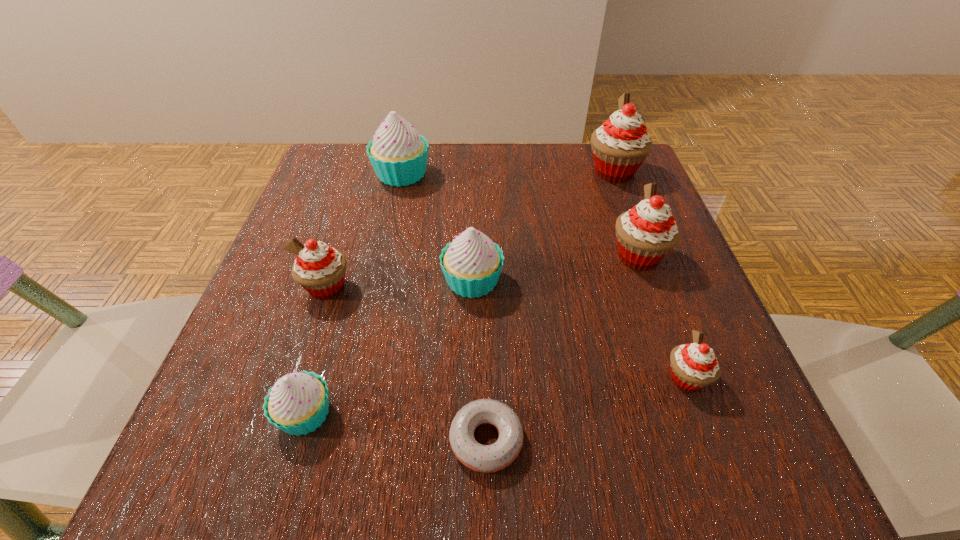
Where is `free location located on the front of the farthest pink cupcake`? This screenshot has height=540, width=960. free location located on the front of the farthest pink cupcake is located at coordinates (637, 232).

You are a GUI agent. You are given a task and a screenshot of the screen. Output one action in this format:
    pyautogui.click(x=<x>, y=<y>)
    Task: Click on the free space located 0.230m on the right of the biggest white cupcake
    The height and width of the screenshot is (540, 960).
    Given the screenshot: What is the action you would take?
    pyautogui.click(x=531, y=174)

You are a GUI agent. You are given a task and a screenshot of the screen. Output one action in this format:
    pyautogui.click(x=<x>, y=<y>)
    Task: Click on the free region located on the back of the second biggest pink cupcake
    Image resolution: width=960 pixels, height=540 pixels.
    Given the screenshot: What is the action you would take?
    pyautogui.click(x=615, y=192)

The width and height of the screenshot is (960, 540). I want to click on vacant space located on the back of the fourth cupcake from left to right, so click(473, 216).

Image resolution: width=960 pixels, height=540 pixels. In order to click on free space located on the front of the third biggest pink cupcake in this screenshot , I will do `click(307, 346)`.

Identify the location of free space located 0.320m on the back of the nearest pink cupcake. The height and width of the screenshot is (540, 960). pos(629,225).

You are a GUI agent. You are given a task and a screenshot of the screen. Output one action in this format:
    pyautogui.click(x=<x>, y=<y>)
    Task: Click on the vacant region located on the back of the smallest white cupcake
    The image size is (960, 540).
    Given the screenshot: What is the action you would take?
    pyautogui.click(x=362, y=221)

Find the location of a particular element. free region located on the back of the shortest object is located at coordinates (485, 326).

The image size is (960, 540). Identify the location of cupcake that is at the near edge. (298, 403).

This screenshot has height=540, width=960. Find the location of `doughnut that is at the near edge`. doughnut that is at the near edge is located at coordinates (482, 458).